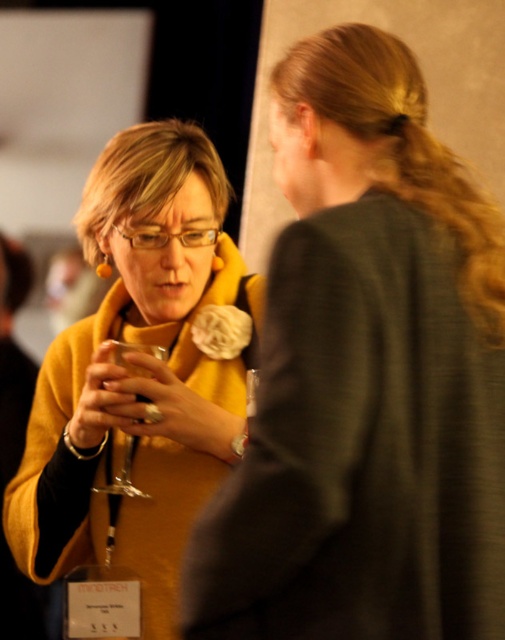
Between matte yellow scarf at left and clear glass wine glass at center, which one has more height?

With more height is matte yellow scarf at left.

Between matte yellow scarf at left and clear glass wine glass at center, which one appears on the left side from the viewer's perspective?

clear glass wine glass at center

At what (x,y) coordinates should I click in order to perform the action: click on matte yellow scarf at left. Please return your answer as a coordinate pair (x, y). Image resolution: width=505 pixels, height=640 pixels. Looking at the image, I should click on (366, 378).

Is matte yellow scarf at left thinner than matte yellow sweater at center?

Yes.

Between point (291, 596) and point (141, 422), which one is positioned behind?

The point (141, 422) is behind.

Find the location of a particular element. This screenshot has width=505, height=640. matte yellow scarf at left is located at coordinates click(x=366, y=378).

Who is positioned more to the right, matte yellow sweater at center or clear glass wine glass at center?

matte yellow sweater at center

Is matte yellow sweater at center smaller than clear glass wine glass at center?

Actually, matte yellow sweater at center might be larger than clear glass wine glass at center.

At what (x,y) coordinates should I click in order to perform the action: click on matte yellow sweater at center. Please return your answer as a coordinate pair (x, y). This screenshot has width=505, height=640. Looking at the image, I should click on (137, 387).

The image size is (505, 640). I want to click on matte yellow sweater at center, so click(x=137, y=387).